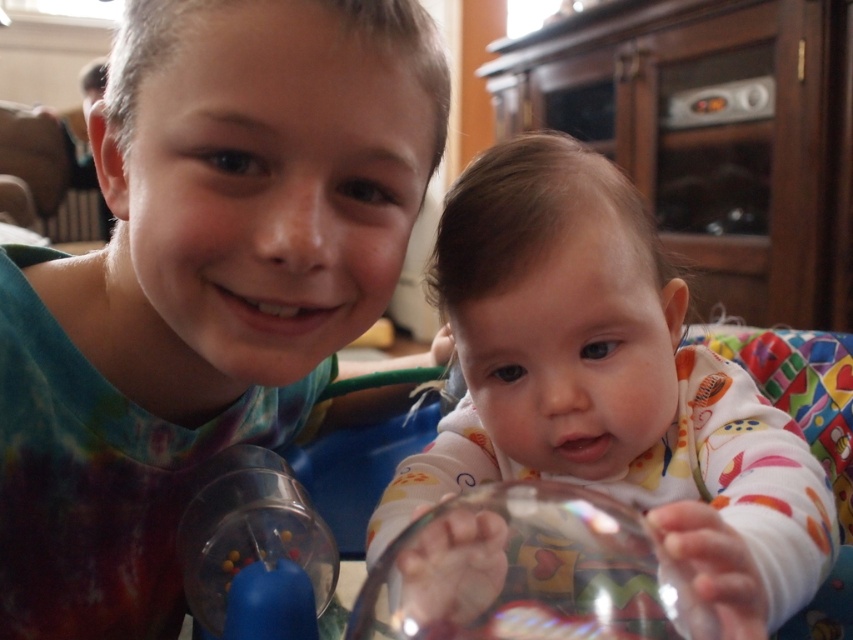
Describe the element at coordinates (201, 282) in the screenshot. I see `tie-dye fabric shirt at left` at that location.

Is tie-dye fabric shirt at left wider than white soft baby at center?

Incorrect, tie-dye fabric shirt at left's width does not surpass white soft baby at center's.

This screenshot has width=853, height=640. I want to click on tie-dye fabric shirt at left, so click(x=201, y=282).

Between tie-dye fabric shirt at left and transparent glass bowl at lower center, which one has more height?

tie-dye fabric shirt at left is taller.

Which of these two, tie-dye fabric shirt at left or transparent glass bowl at lower center, stands shorter?

Standing shorter between the two is transparent glass bowl at lower center.

Is point (76, 353) positioned after point (577, 564)?

Yes, it is behind point (577, 564).

Find the location of a particular element. tie-dye fabric shirt at left is located at coordinates (201, 282).

Can you confirm if white soft baby at center is smaller than transparent glass bowl at lower center?

Incorrect, white soft baby at center is not smaller in size than transparent glass bowl at lower center.

Does white soft baby at center have a larger size compared to transparent glass bowl at lower center?

Indeed, white soft baby at center has a larger size compared to transparent glass bowl at lower center.

Where is `white soft baby at center`? white soft baby at center is located at coordinates (607, 381).